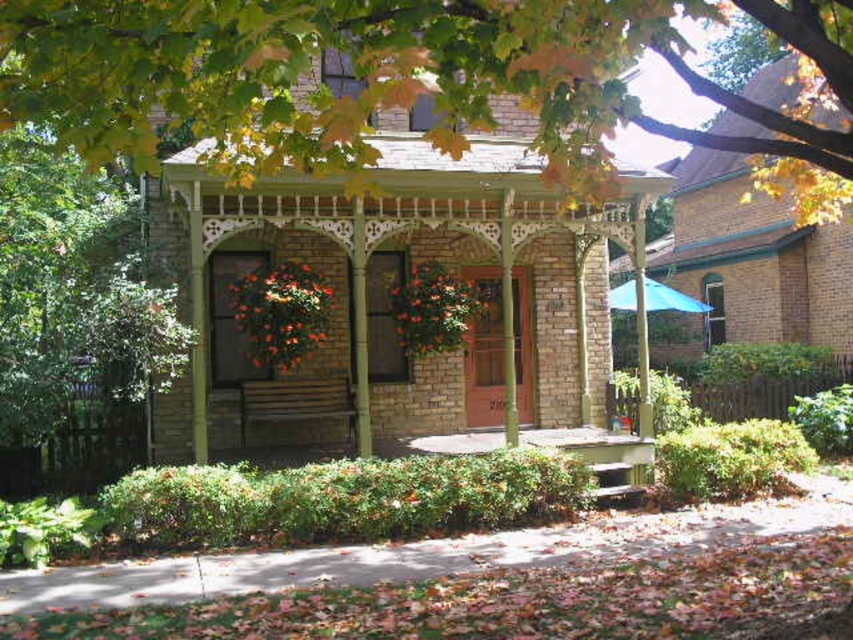
Can you confirm if green leafy tree at upper center is bigger than green wood gazebo at center?

Actually, green leafy tree at upper center might be smaller than green wood gazebo at center.

Which is in front, point (149, 45) or point (427, 170)?

Point (149, 45)

Locate an element on the screen. The image size is (853, 640). green leafy tree at upper center is located at coordinates (376, 83).